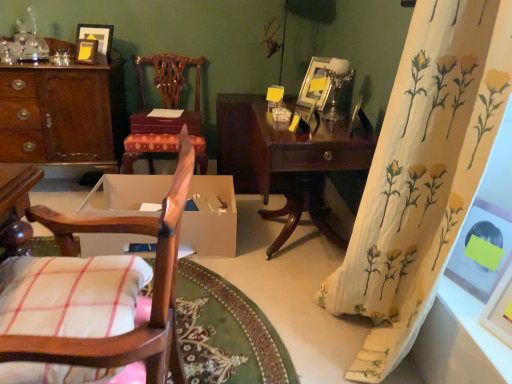
This screenshot has width=512, height=384. I want to click on free space in front of matte yellow picture frame at right, the fourth picture frame positioned from the back, so click(470, 306).